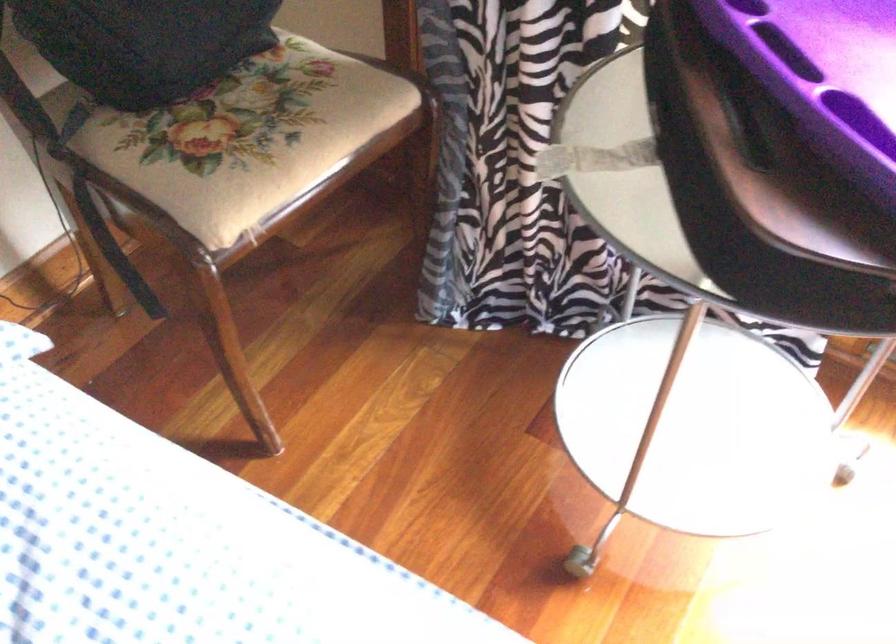
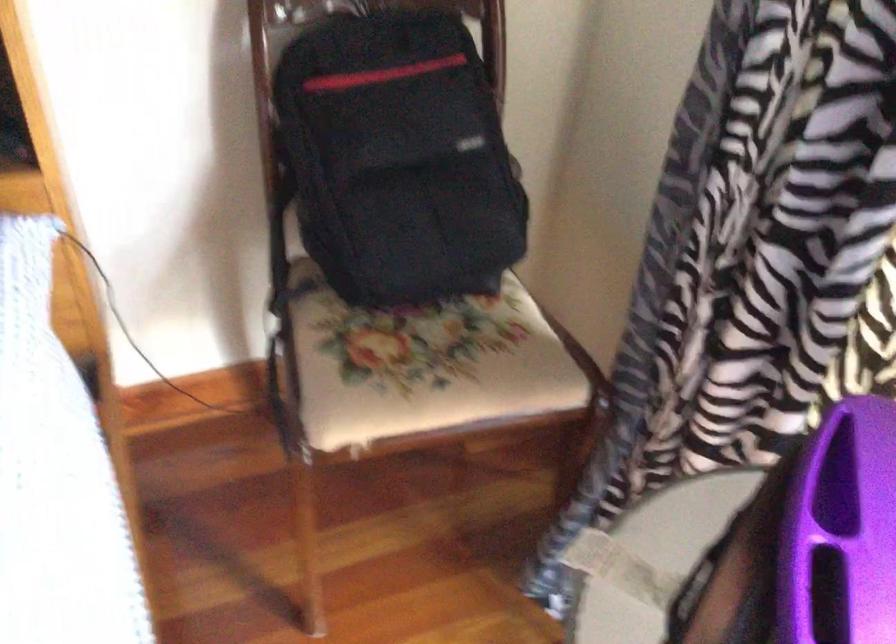
Question: The images are taken continuously from a first-person perspective. In which direction is your viewpoint rotating?

Choices:
 (A) Left
 (B) Right
 (C) Up
 (D) Down

Answer: (A)